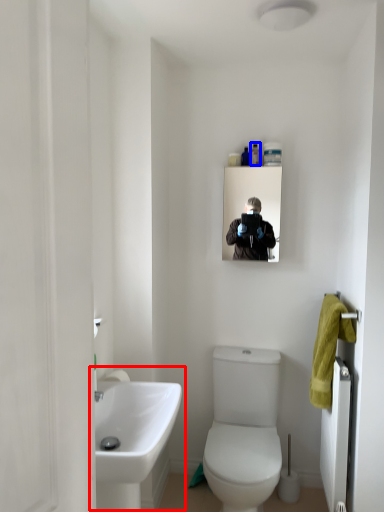
Question: Which point is further to the camera, sink (highlighted by a red box) or toiletry (highlighted by a blue box)?

Choices:
 (A) sink
 (B) toiletry

Answer: (B)